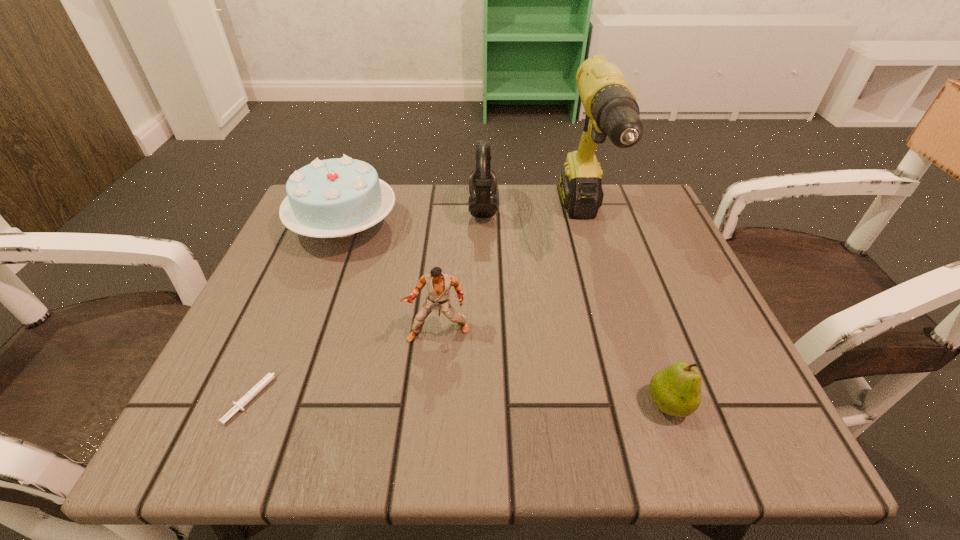
The image size is (960, 540). Identify the location of the tallest object. (611, 108).

I want to click on headset, so tap(482, 202).

I want to click on birthday cake, so click(339, 197).

At what (x,y) coordinates should I click in order to perform the action: click on the third nearest object. Please return your answer as a coordinate pair (x, y). Looking at the image, I should click on (439, 285).

This screenshot has height=540, width=960. Find the location of `the fifth tallest object`. the fifth tallest object is located at coordinates (676, 390).

I want to click on the shortest object, so click(238, 405).

Identify the location of free space located 0.250m on the handle side of the drill. (631, 384).

The height and width of the screenshot is (540, 960). I want to click on vacant point located on the earcups of the headset, so click(x=402, y=210).

This screenshot has width=960, height=540. Identify the location of free space located on the earcups of the headset. (402, 210).

The height and width of the screenshot is (540, 960). I want to click on blank space located 0.080m on the earcups of the headset, so click(436, 210).